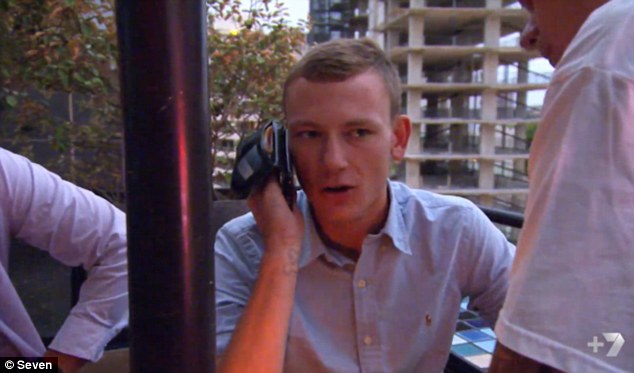
You are a GUI agent. You are given a task and a screenshot of the screen. Output one action in this format:
    pyautogui.click(x=<x>, y=<y>)
    Task: Click on the phone
    The width and height of the screenshot is (634, 373).
    Given the screenshot: What is the action you would take?
    pyautogui.click(x=288, y=167)